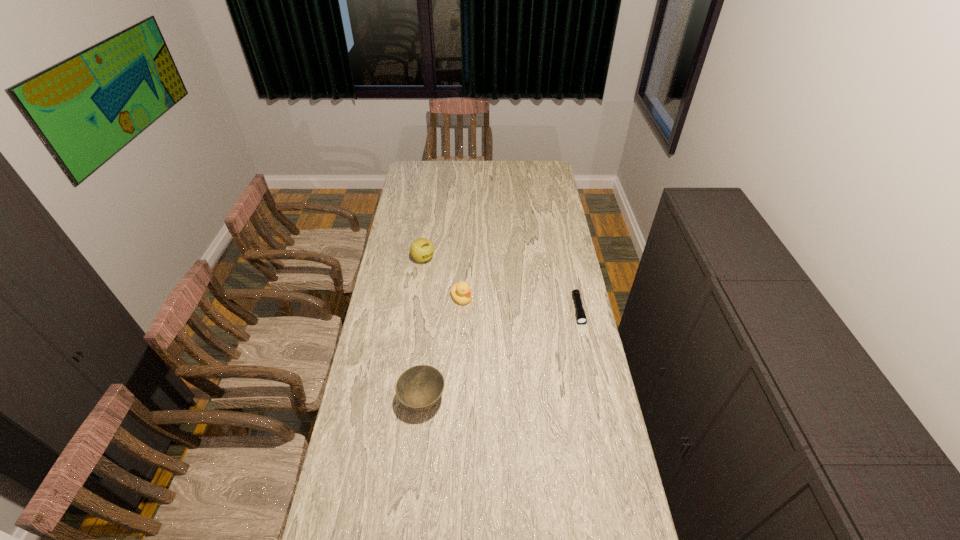
I want to click on free space located 0.380m on the face of the duckling, so click(x=523, y=366).

This screenshot has width=960, height=540. In order to click on vacant space positioned on the face of the duckling in this screenshot , I will do coord(488,327).

Identify the location of vacant area located 0.200m on the face of the duckling. (x=495, y=335).

Image resolution: width=960 pixels, height=540 pixels. Find the location of `bowl at the left edge`. bowl at the left edge is located at coordinates (419, 387).

Locate an element on the screen. Image resolution: width=960 pixels, height=540 pixels. softball that is at the left edge is located at coordinates (422, 249).

This screenshot has width=960, height=540. I want to click on object located at the right edge, so click(x=581, y=318).

This screenshot has height=540, width=960. In the image, there is a desktop. Find the location of `vacant region at the near edge`. vacant region at the near edge is located at coordinates pos(457,515).

In the image, there is a desktop. Identify the location of vacant space at the left edge. (361, 432).

In the image, there is a desktop. Find the location of `blank space at the right edge`. blank space at the right edge is located at coordinates pos(612,434).

This screenshot has width=960, height=540. Find the location of `vacant space at the far right corner of the desktop`. vacant space at the far right corner of the desktop is located at coordinates (548, 174).